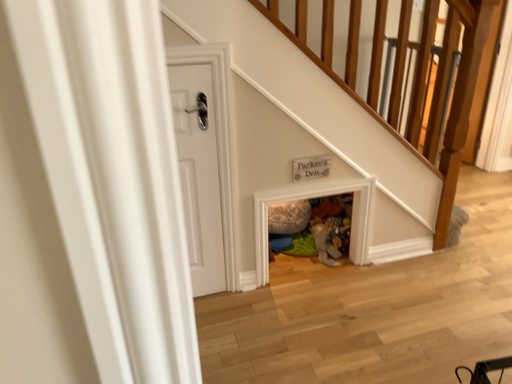
Measure the distance between point (206, 106) and camera.

The depth of point (206, 106) is 6.06 feet.

The image size is (512, 384). What do you see at coordinates (199, 173) in the screenshot? I see `white glossy door at center` at bounding box center [199, 173].

What is the approximate width of white glossy door at center?

2.29 inches.

Where is `white glossy door at center`? This screenshot has width=512, height=384. white glossy door at center is located at coordinates (199, 173).

You are a GUI agent. You are given a task and a screenshot of the screen. Output one action in this format:
    pyautogui.click(x=<x>, y=<y>)
    Task: Click on the white glossy door at center
    
    Given the screenshot: What is the action you would take?
    pyautogui.click(x=199, y=173)